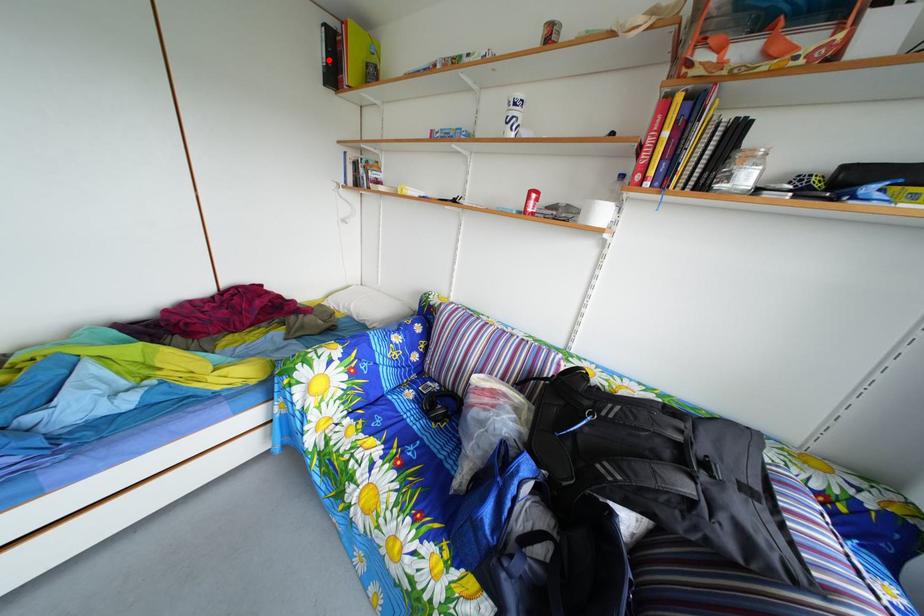
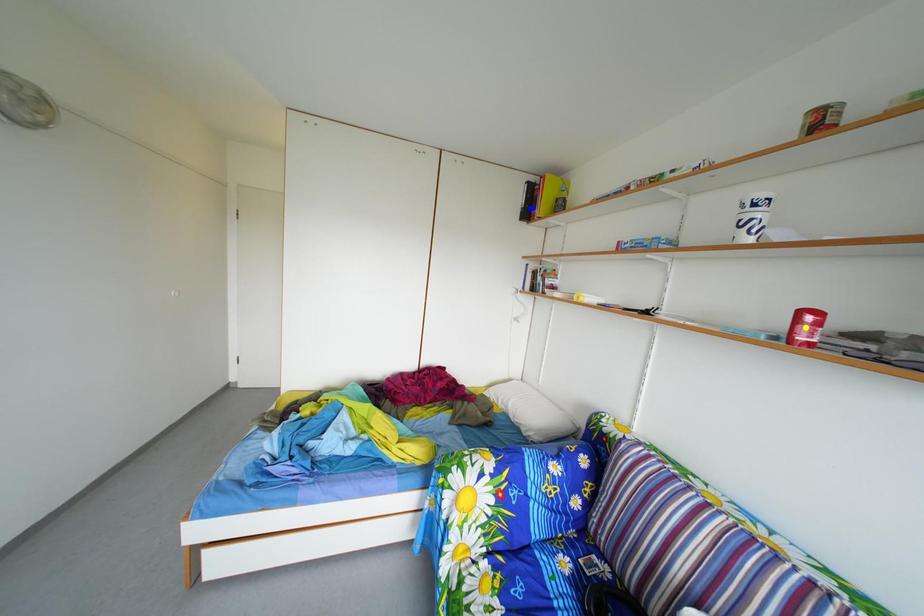
Question: I am providing you with two images of the same scene from different viewpoints. A red point is marked on the first image. You are given multiple points on the second image. Which mark in image 2 goes with the point in image 1?

Choices:
 (A) blue point
 (B) green point
 (C) yellow point

Answer: (A)